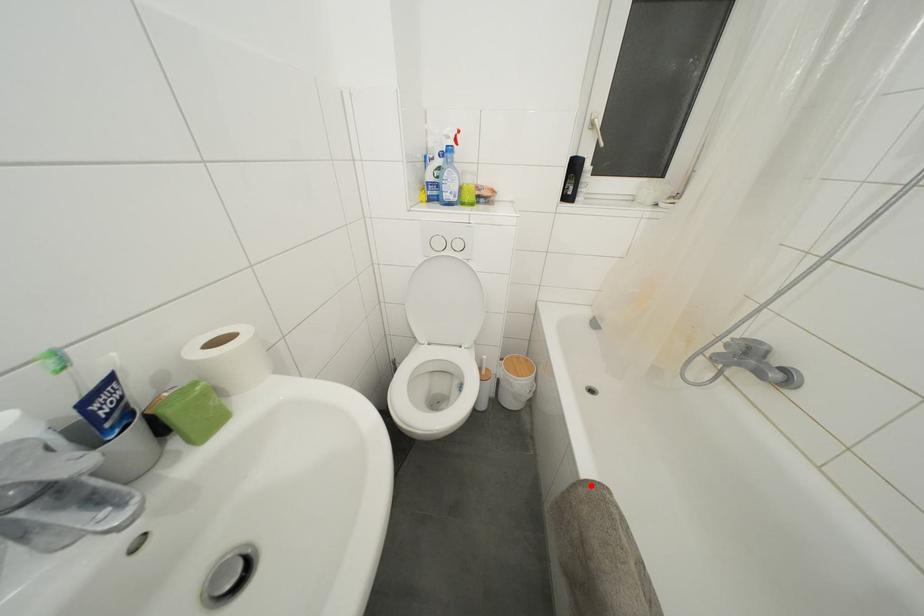
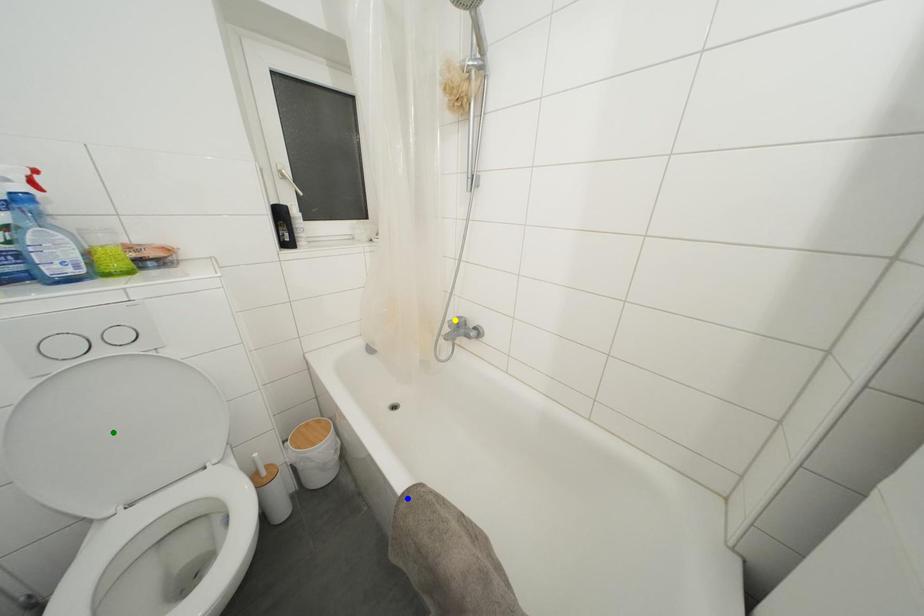
Question: I am providing you with two images of the same scene from different viewpoints. A red point is marked on the first image. You are given multiple points on the second image. Which point in image 2 is actually the same real-world point as the red point in image 1?

Choices:
 (A) blue point
 (B) green point
 (C) yellow point

Answer: (A)